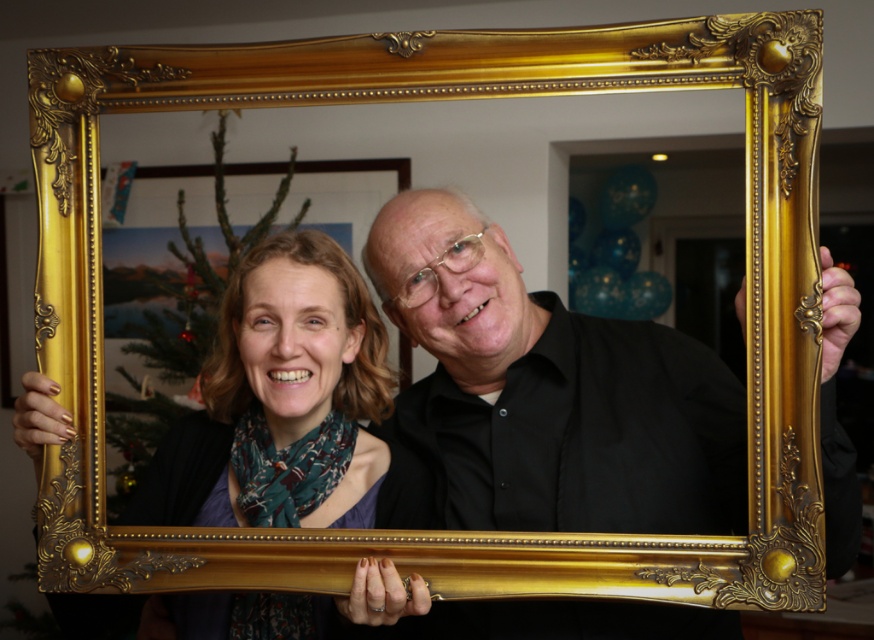
Question: Which of the following is the farthest from the observer?

Choices:
 (A) black matte shirt at center
 (B) matte gold frame at center

Answer: (B)

Question: Where is black matte shirt at center located in relation to matte gold frame at center in the image?

Choices:
 (A) left
 (B) right

Answer: (B)

Question: Does black matte shirt at center appear under matte gold frame at center?

Choices:
 (A) yes
 (B) no

Answer: (B)

Question: From the image, what is the correct spatial relationship of black matte shirt at center in relation to matte gold frame at center?

Choices:
 (A) right
 (B) left

Answer: (A)